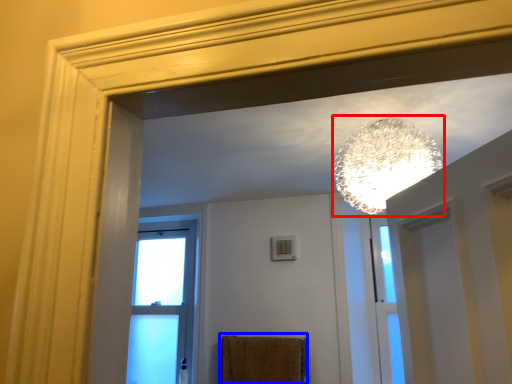
Question: Which of the following is the farthest to the observer, lamp (highlighted by a red box) or bath towel (highlighted by a blue box)?

Choices:
 (A) lamp
 (B) bath towel

Answer: (B)